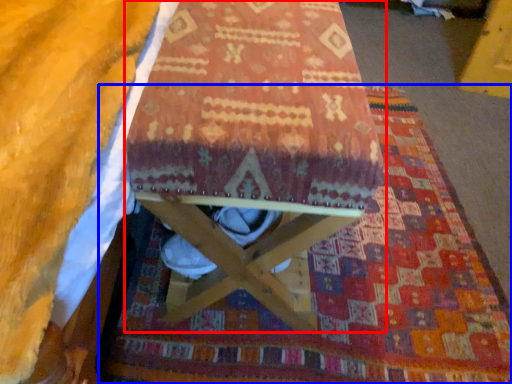
Question: Which object is closer to the camera taking this photo, furniture (highlighted by a red box) or mat (highlighted by a blue box)?

Choices:
 (A) furniture
 (B) mat

Answer: (A)